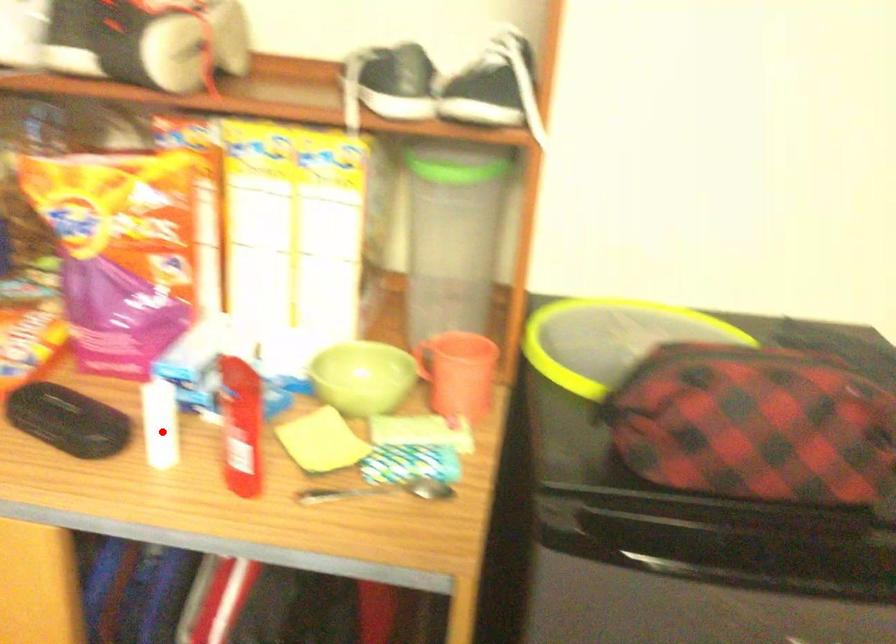
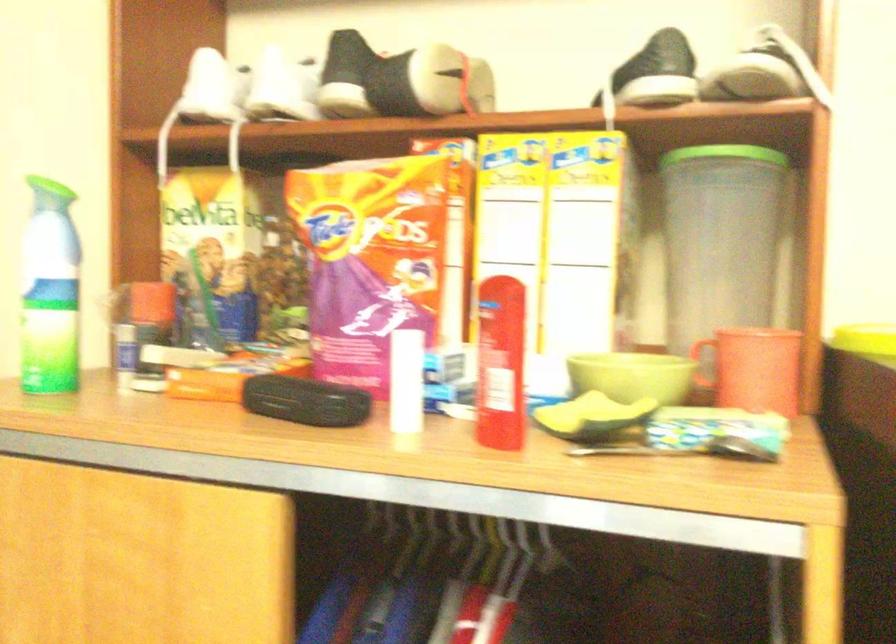
The point at the highlighted location is marked in the first image. Where is the corresponding point in the second image?

(407, 386)